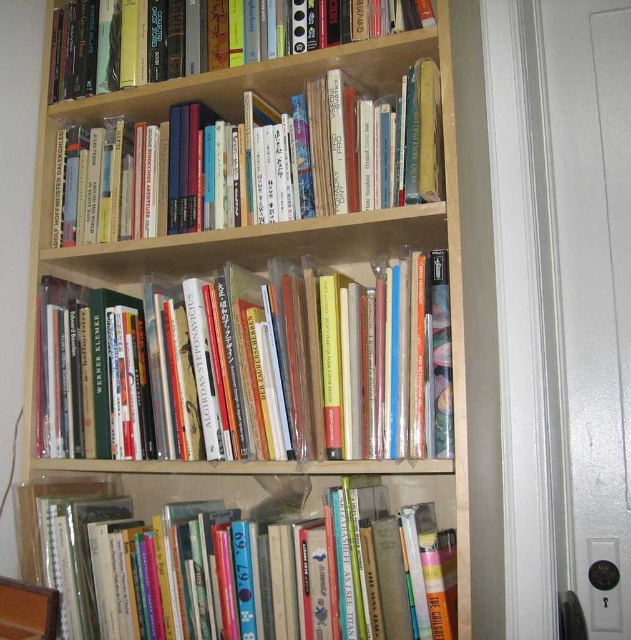
Question: Is hardcover books at upper center further to the viewer compared to hardcover books at upper left?

Choices:
 (A) no
 (B) yes

Answer: (A)

Question: Which point is farther to the camera?

Choices:
 (A) hardcover books at center
 (B) hardcover books at lower center
 (C) hardcover books at upper left
 (D) hardcover books at upper center

Answer: (C)

Question: Among these points, which one is nearest to the camera?

Choices:
 (A) (160, 131)
 (B) (413, 509)

Answer: (B)

Question: Does hardcover books at center come in front of hardcover books at upper center?

Choices:
 (A) yes
 (B) no

Answer: (A)

Question: Is the position of hardcover books at center less distant than that of hardcover books at upper center?

Choices:
 (A) yes
 (B) no

Answer: (A)

Question: Which point is closer to the camera?

Choices:
 (A) (124, 22)
 (B) (444, 380)
 (C) (418, 188)

Answer: (B)